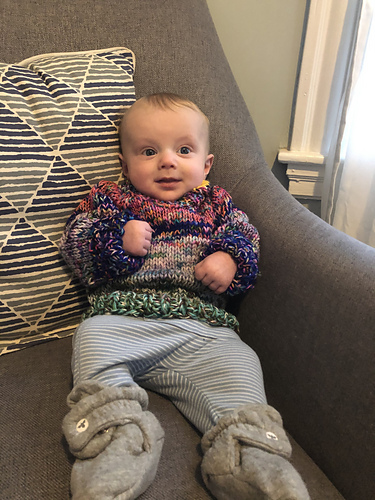
Locate an element on the screen. The width and height of the screenshot is (375, 500). wall is located at coordinates (254, 58).